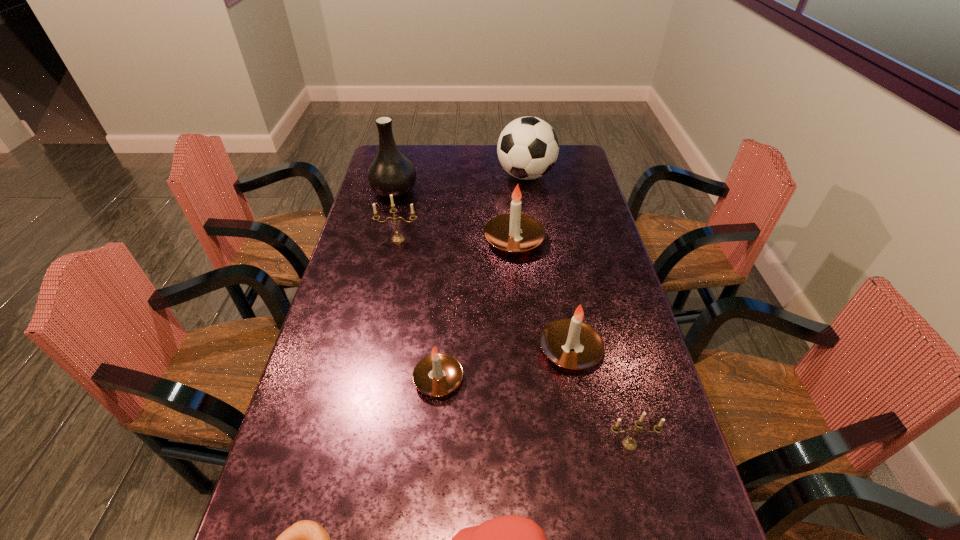
Identify the location of candle that is positioned at the left edge. [x=397, y=238].

Locate an element on the screen. The height and width of the screenshot is (540, 960). soccer ball that is at the right edge is located at coordinates (528, 147).

Locate an element on the screen. object located in the far right corner section of the desktop is located at coordinates (528, 147).

Where is `free region at the far edge`? free region at the far edge is located at coordinates (419, 165).

Where is `vacant space at the left edge of the desktop`? Image resolution: width=960 pixels, height=540 pixels. vacant space at the left edge of the desktop is located at coordinates (348, 350).

I want to click on free space at the right edge of the desktop, so 621,521.

Identify the location of free space between the biggest white candle and the smallest white candle. (476, 310).

This screenshot has height=540, width=960. I want to click on vacant area that lies between the biggest white candle and the second biggest white candle, so click(542, 295).

At what (x,y) coordinates should I click in order to perform the action: click on empty space that is in between the nearer metallic candle and the second smallest white candle. Please return your answer as a coordinate pair (x, y). The height and width of the screenshot is (540, 960). Looking at the image, I should click on (600, 397).

Where is `free space between the left metallic candle and the black soccer ball`? free space between the left metallic candle and the black soccer ball is located at coordinates (462, 207).